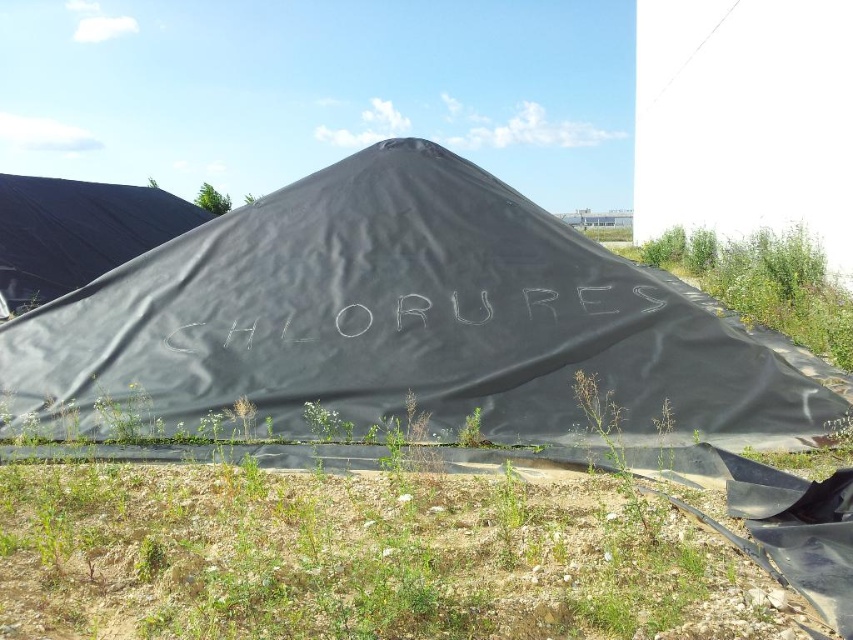
Who is shorter, black tarp at center or green grass at lower center?

green grass at lower center

Is black tarp at center below green grass at lower center?

Actually, black tarp at center is above green grass at lower center.

Identify the location of black tarp at center. (396, 324).

Between point (229, 378) and point (115, 248), which one is positioned behind?

Point (115, 248)

Is point (357, 332) more distant than point (32, 224)?

That is False.

Locate an element on the screen. The width and height of the screenshot is (853, 640). black tarp at center is located at coordinates (396, 324).

Which of these two, black tarp at center or white chalk writing at center, stands shorter?

With less height is white chalk writing at center.

Is black tarp at center bigger than white chalk writing at center?

Yes, black tarp at center is bigger than white chalk writing at center.

Image resolution: width=853 pixels, height=640 pixels. Identify the location of black tarp at center. (396, 324).

You are a GUI agent. You are given a task and a screenshot of the screen. Output one action in this format:
    pyautogui.click(x=<x>, y=<y>)
    Task: Click on the black tarp at center
    This screenshot has width=853, height=640.
    Given the screenshot: What is the action you would take?
    pyautogui.click(x=396, y=324)